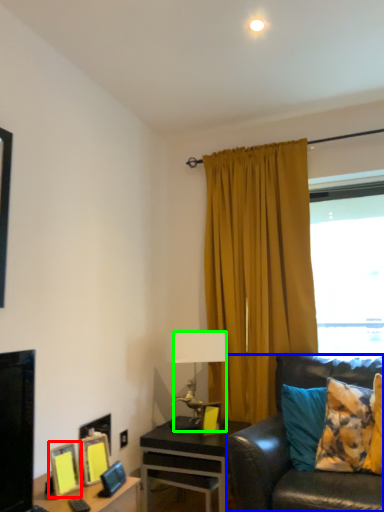
Question: Which is nearer to the picture frame (highlighted by a red box)? studio couch (highlighted by a blue box) or lamp (highlighted by a green box).

Choices:
 (A) studio couch
 (B) lamp

Answer: (A)